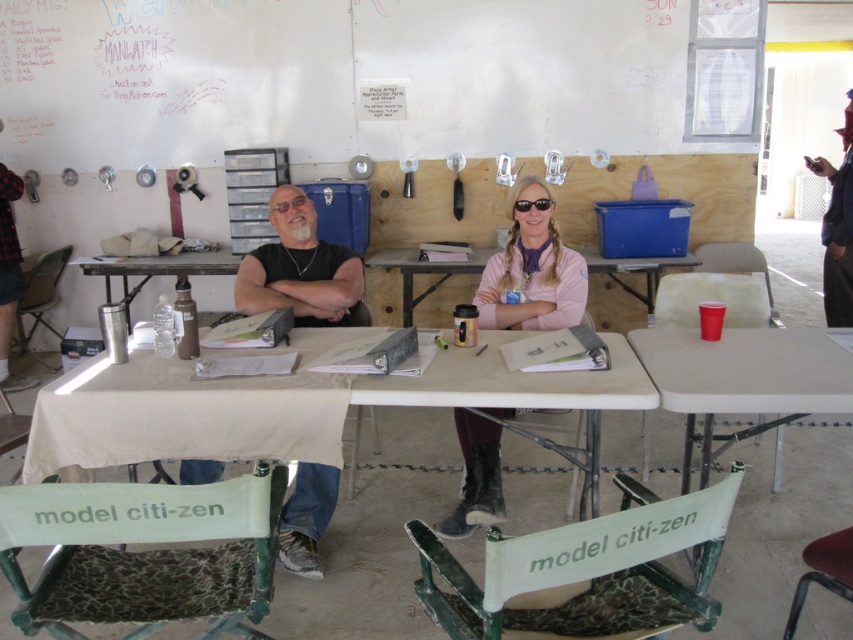
You are organizing a workshop and need to access the red plastic cup at right. The white matte bulletin board at upper center is blocking your view. Can you move the cup without moving the bulletin board?

The red plastic cup at right is behind the white matte bulletin board at upper center, so you cannot see or access the cup without moving the bulletin board first.

You are organizing a small event and need to decide which table to use. The white plastic table at center and the pink fabric table at center are available. Based on their sizes, which one can accommodate more people comfortably?

The white plastic table at center is wider than the pink fabric table at center, so it can accommodate more people comfortably.

Based on the coordinates provided, which object is located at point (741,380) in the scene?

The point (741,380) corresponds to the red plastic cup at right.